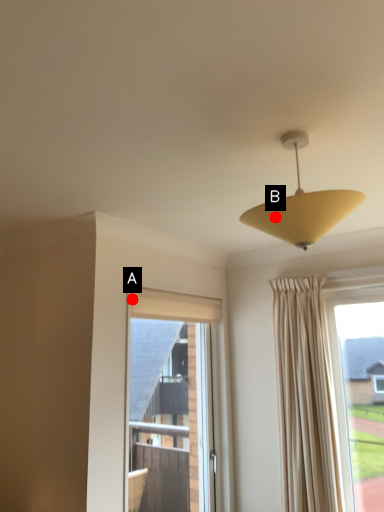
Question: Two points are circled on the image, labeled by A and B beside each circle. Which point is farther to the camera?

Choices:
 (A) A is further
 (B) B is further

Answer: (A)